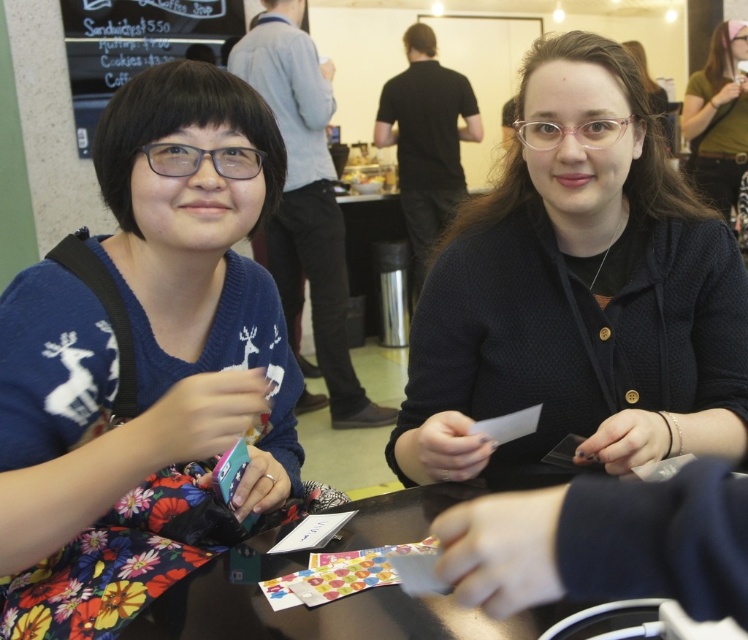
You are standing at the camera position and want to reach point (10,298). Is the distance less than 30 inches?

The distance between point (10,298) and the camera is 33.02 inches, which is more than 30 inches. Therefore, the distance is not less than 30 inches.

You are a guest at this event and want to retrieve the colorful paper cards at center to join the game. However, the matte black cardigan at center is covering them. Can you easily access the cards without moving the cardigan?

The matte black cardigan at center is positioned over colorful paper cards at center, so you cannot easily access the cards without moving the cardigan.

You are a photographer at the event and want to capture a closeup of both the blue sweater at left and the white paper at center in a single shot. Given that your camera has a minimum focus distance of 12 inches, will you be able to achieve this without moving either object?

The blue sweater at left and white paper at center are 11.82 inches apart, which is less than the camera minimum focus distance of 12 inches. Therefore, you can capture both in a single shot without moving the objects.